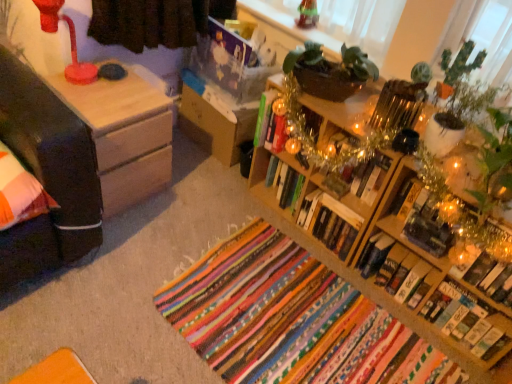
What are the coordinates of `free location in front of wooden nightstand at left` in the screenshot? It's located at (120, 243).